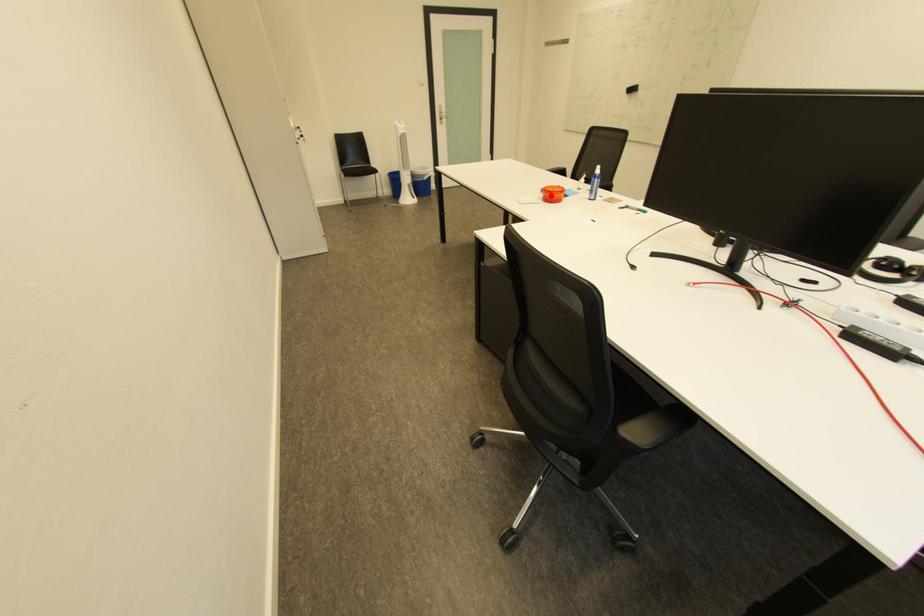
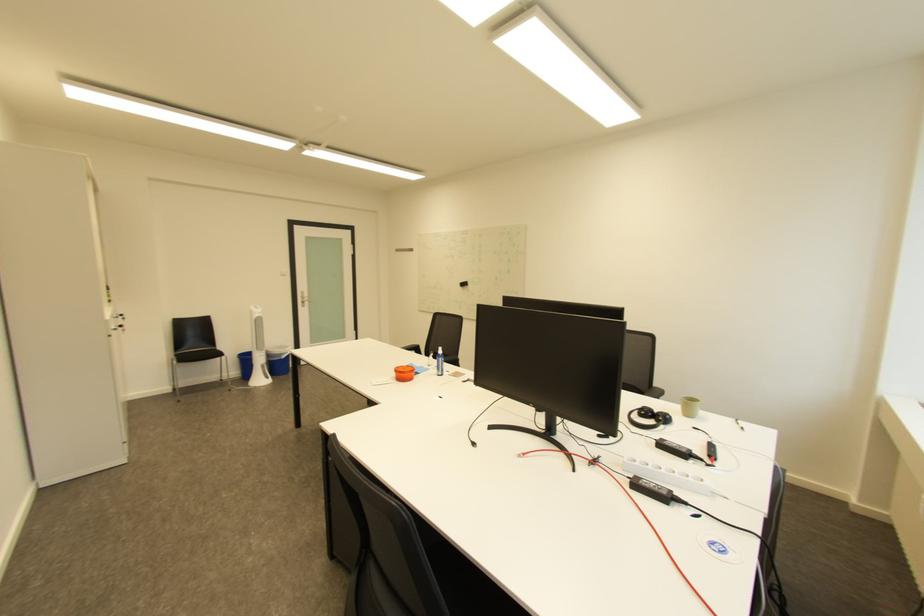
In the second image, find the point that corresponds to the highlighted location in the first image.

(404, 376)